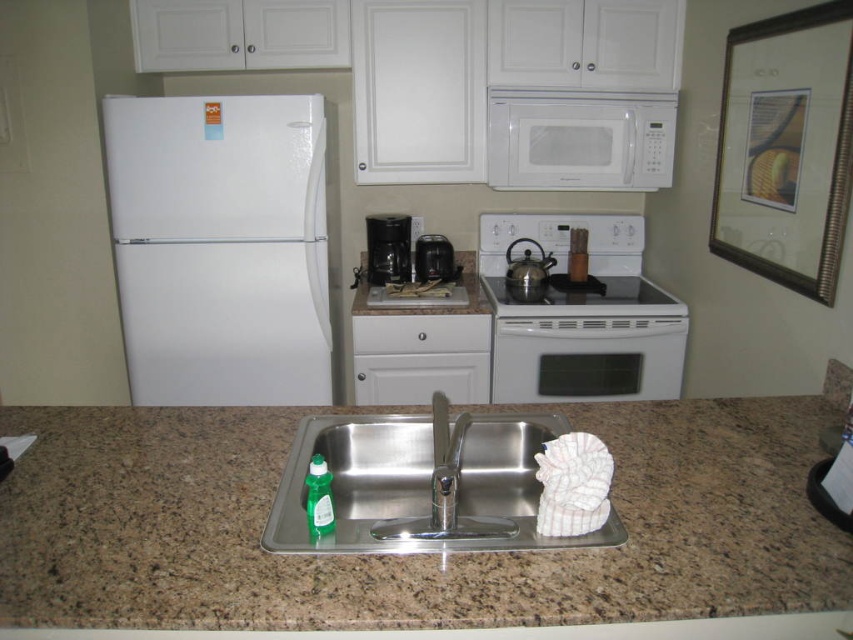
Question: Considering the real-world distances, which object is farthest from the granite countertop at center?

Choices:
 (A) white matte refrigerator at left
 (B) polished stainless steel faucet at center
 (C) stainless steel sink at center

Answer: (A)

Question: Is the position of granite countertop at center less distant than that of matte black coffee maker at center?

Choices:
 (A) no
 (B) yes

Answer: (B)

Question: Which is farther from the matte black coffee maker at center?

Choices:
 (A) black plastic coffee maker at center
 (B) polished stainless steel faucet at center
 (C) white glossy electric stove at upper center

Answer: (B)

Question: Is granite countertop at center to the right of matte black coffee maker at center from the viewer's perspective?

Choices:
 (A) no
 (B) yes

Answer: (A)

Question: Among these objects, which one is farthest from the camera?

Choices:
 (A) white matte refrigerator at left
 (B) stainless steel sink at center
 (C) matte black coffee maker at center
 (D) white matte microwave at upper center

Answer: (C)

Question: Can you confirm if white matte microwave at upper center is thinner than matte black coffee maker at center?

Choices:
 (A) yes
 (B) no

Answer: (B)